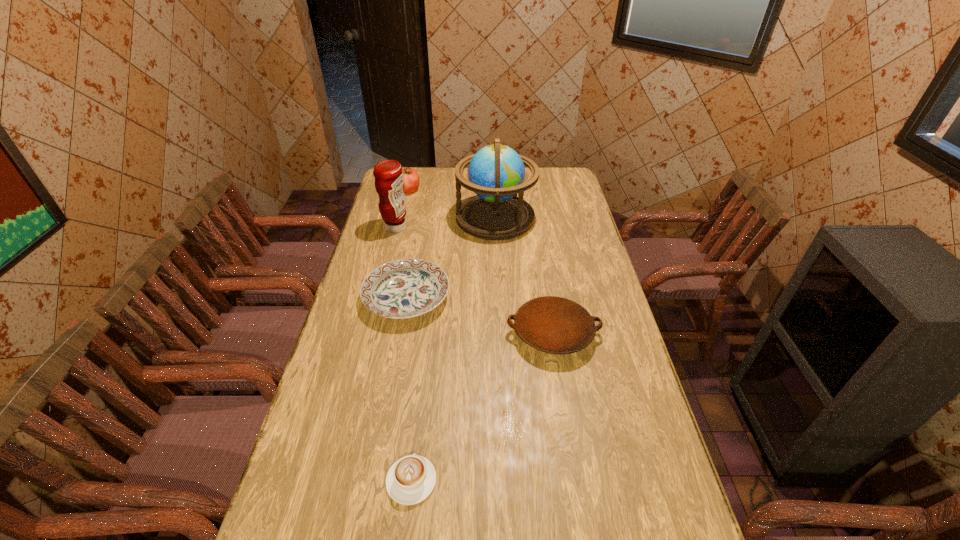
Locate an element on the screen. This screenshot has width=960, height=540. free space between the apple and the left plate is located at coordinates (408, 244).

The width and height of the screenshot is (960, 540). In order to click on empty space between the cappuccino and the condiment in this screenshot , I will do `click(403, 354)`.

Where is `object that can be found as the third closest to the taller plate`? object that can be found as the third closest to the taller plate is located at coordinates (496, 173).

Identify which object is located as the third nearest to the farthest object. Please provide its 2D coordinates. Your answer should be formatted as a tuple, i.e. [(x, y)], where the tuple contains the x and y coordinates of a point satisfying the conditions above.

[(405, 288)]

You are a GUI agent. You are given a task and a screenshot of the screen. Output one action in this format:
    pyautogui.click(x=<x>, y=<y>)
    Task: Click on the vacant space that satisfies the following two spatial constraints: 1. on the front side of the shorter plate; 2. on the left side of the taller plate
    
    Given the screenshot: What is the action you would take?
    pyautogui.click(x=400, y=334)

I want to click on free space that satisfies the following two spatial constraints: 1. on the back side of the fifth shortest object; 2. on the right side of the globe, so click(x=398, y=218).

Where is `vacant space that satisfies the following two spatial constraints: 1. with the handle on the right side of the tallest object; 2. on the left side of the cappuccino`? The width and height of the screenshot is (960, 540). vacant space that satisfies the following two spatial constraints: 1. with the handle on the right side of the tallest object; 2. on the left side of the cappuccino is located at coordinates (442, 218).